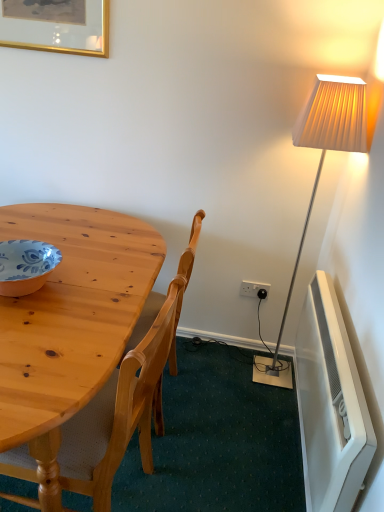
Question: Is white plastic power outlet at lower right to the left or to the right of white plastic radiator at lower right in the image?

Choices:
 (A) right
 (B) left

Answer: (B)

Question: Is point (253, 286) closer or farther from the camera than point (332, 445)?

Choices:
 (A) farther
 (B) closer

Answer: (A)

Question: Estimate the real-world distances between objects in this image. Which object is farther from the natural wood chair at left?

Choices:
 (A) white plastic power outlet at lower right
 (B) gold-framed picture at upper left
 (C) matte orange bowl at left
 (D) white plastic radiator at lower right

Answer: (B)

Question: Estimate the real-world distances between objects in this image. Which object is farther from the gold-framed picture at upper left?

Choices:
 (A) matte orange bowl at left
 (B) white plastic power outlet at lower right
 (C) natural wood chair at left
 (D) white plastic radiator at lower right

Answer: (D)